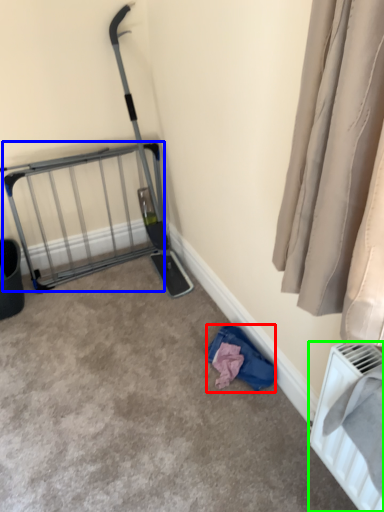
Question: Considering the real-world distances, which object is closest to clothing (highlighted by a red box)? cage (highlighted by a blue box) or radiator (highlighted by a green box).

Choices:
 (A) cage
 (B) radiator

Answer: (B)